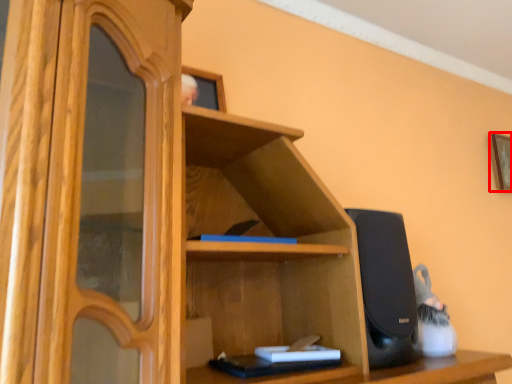
Question: Considering the relative positions of picture frame (annotated by the red box) and book in the image provided, where is picture frame (annotated by the red box) located with respect to the staircase?

Choices:
 (A) left
 (B) right

Answer: (B)